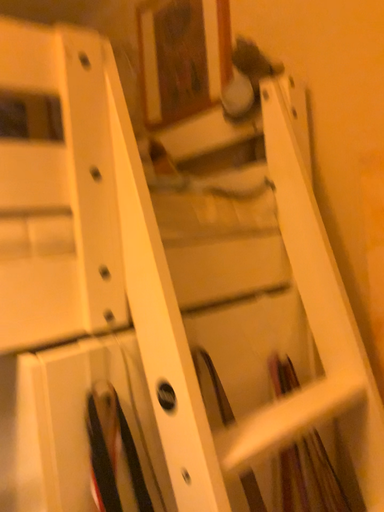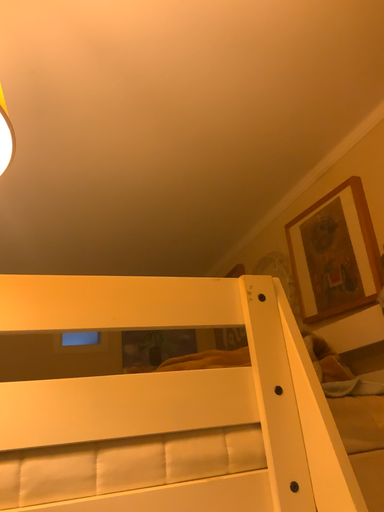
Question: Which way did the camera rotate in the video?

Choices:
 (A) rotated right
 (B) rotated left

Answer: (B)